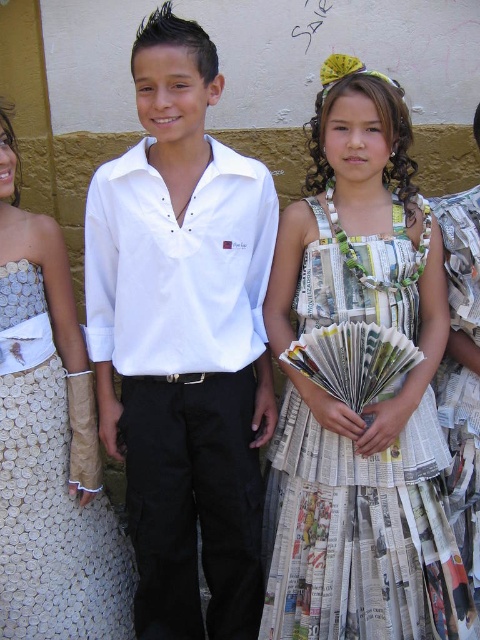
Looking at the scene, you notice the white cotton shirt at center and the recycled paper dress at center. Which clothing item is taller in the image?

The white cotton shirt at center is taller than the recycled paper dress at center according to the description.